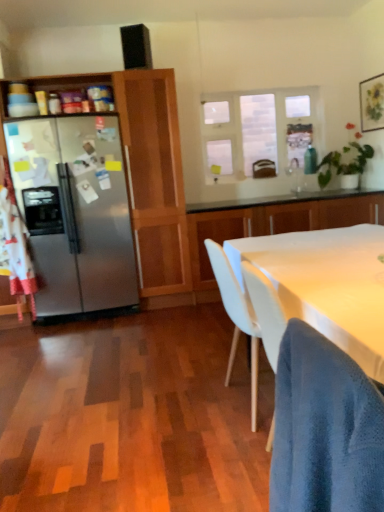
Question: Is green leafy plant at upper right taller than clear glass window at upper center?

Choices:
 (A) no
 (B) yes

Answer: (A)

Question: From a real-world perspective, is green leafy plant at upper right on clear glass window at upper center?

Choices:
 (A) no
 (B) yes

Answer: (A)

Question: Would you say green leafy plant at upper right is a long distance from clear glass window at upper center?

Choices:
 (A) yes
 (B) no

Answer: (B)

Question: Considering the relative positions of green leafy plant at upper right and clear glass window at upper center in the image provided, is green leafy plant at upper right behind clear glass window at upper center?

Choices:
 (A) no
 (B) yes

Answer: (A)

Question: Does green leafy plant at upper right appear on the left side of clear glass window at upper center?

Choices:
 (A) no
 (B) yes

Answer: (A)

Question: Is clear glass window at upper center inside the boundaries of white glossy cabinet at center, positioned as the second cabinetry in left-to-right order, or outside?

Choices:
 (A) inside
 (B) outside

Answer: (B)

Question: Considering the positions of clear glass window at upper center and white glossy cabinet at center, positioned as the second cabinetry in left-to-right order, in the image, is clear glass window at upper center taller or shorter than white glossy cabinet at center, positioned as the second cabinetry in left-to-right order,?

Choices:
 (A) tall
 (B) short

Answer: (A)

Question: Considering their positions, is clear glass window at upper center located in front of or behind white glossy cabinet at center, positioned as the second cabinetry in left-to-right order?

Choices:
 (A) front
 (B) behind

Answer: (B)

Question: Is clear glass window at upper center to the left or to the right of white glossy cabinet at center, arranged as the first cabinetry when viewed from the right, in the image?

Choices:
 (A) right
 (B) left

Answer: (B)

Question: From a real-world perspective, is clear glass window at upper center positioned above or below green leafy plant at upper right?

Choices:
 (A) above
 (B) below

Answer: (A)

Question: Is clear glass window at upper center inside the boundaries of green leafy plant at upper right, or outside?

Choices:
 (A) outside
 (B) inside

Answer: (A)

Question: Is point (278, 154) closer or farther from the camera than point (327, 155)?

Choices:
 (A) closer
 (B) farther

Answer: (B)

Question: Relative to green leafy plant at upper right, is clear glass window at upper center in front or behind?

Choices:
 (A) front
 (B) behind

Answer: (B)

Question: From the image's perspective, is blue textured fabric chair at lower right above or below satin silver refrigerator at left, marked as the 2th cabinetry in a right-to-left arrangement?

Choices:
 (A) below
 (B) above

Answer: (A)

Question: From a real-world perspective, relative to satin silver refrigerator at left, positioned as the 1th cabinetry in left-to-right order, is blue textured fabric chair at lower right vertically above or below?

Choices:
 (A) below
 (B) above

Answer: (A)